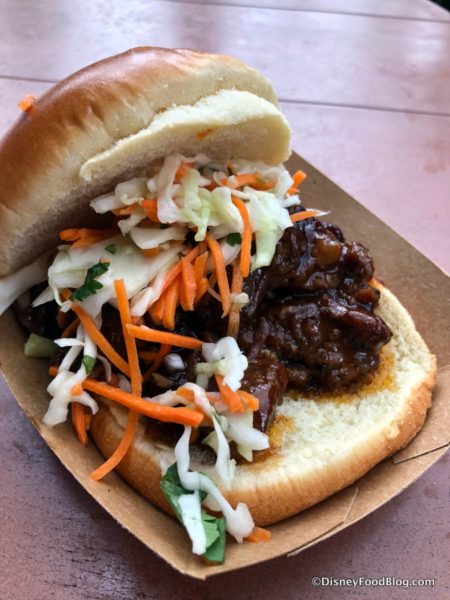
This screenshot has height=600, width=450. I want to click on empty space to the right of table, so click(x=444, y=3).